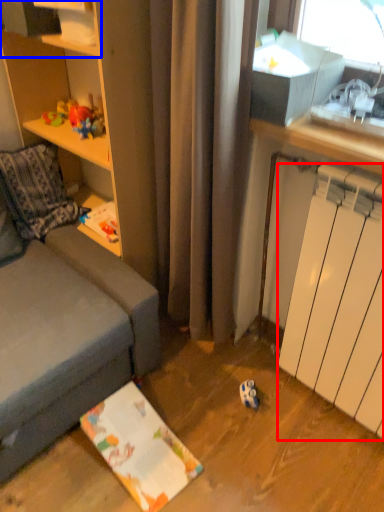
Question: Which of the following is the closest to the observer, radiator (highlighted by a red box) or shelf (highlighted by a blue box)?

Choices:
 (A) radiator
 (B) shelf

Answer: (A)